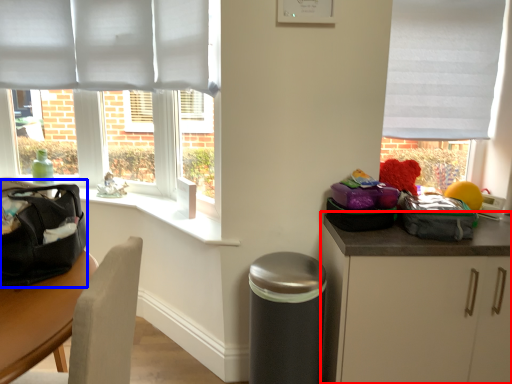
Question: Which of the following is the farthest to the observer, cabinetry (highlighted by a red box) or pack (highlighted by a blue box)?

Choices:
 (A) cabinetry
 (B) pack

Answer: (A)